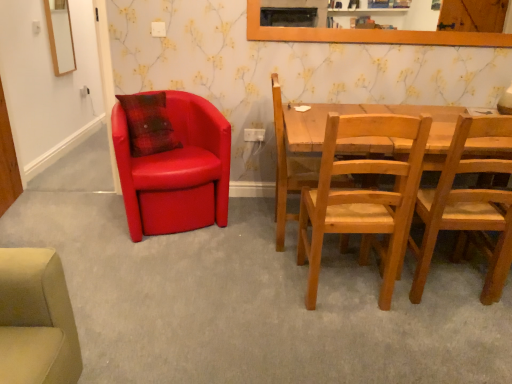
Locate an element on the screen. This screenshot has height=384, width=512. vacant space to the right of matte leather chair at left, the 4th chair from the right is located at coordinates (248, 225).